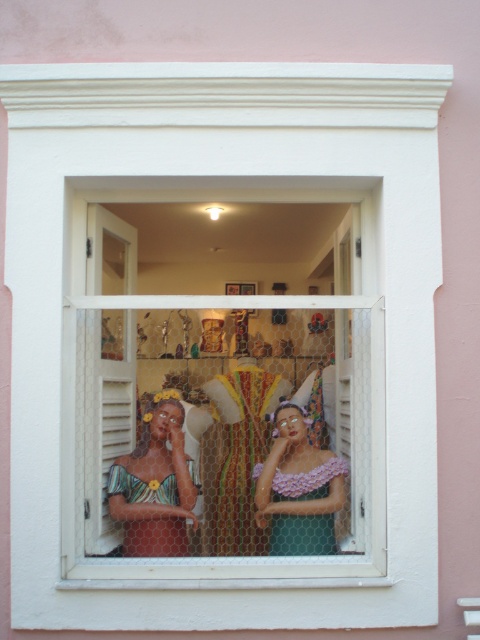
Describe the element at coordinates (224, 378) in the screenshot. I see `transparent plastic dolls at center` at that location.

Between transparent plastic dolls at center and matte green dress at center, which one is positioned higher?

transparent plastic dolls at center is higher up.

What do you see at coordinates (224, 378) in the screenshot? Image resolution: width=480 pixels, height=640 pixels. I see `transparent plastic dolls at center` at bounding box center [224, 378].

You are a GUI agent. You are given a task and a screenshot of the screen. Output one action in this format:
    pyautogui.click(x=<x>, y=<y>)
    Task: Click on the transparent plastic dolls at center
    
    Given the screenshot: What is the action you would take?
    pyautogui.click(x=224, y=378)

Who is lower down, multicolored fabric dress at center or matte green dress at center?

matte green dress at center is lower down.

Is multicolored fabric dress at center behind matte green dress at center?

No, multicolored fabric dress at center is closer to the viewer.

Which is behind, point (133, 477) or point (279, 410)?

Point (279, 410)

The image size is (480, 640). I want to click on multicolored fabric dress at center, so click(x=155, y=484).

The width and height of the screenshot is (480, 640). What do you see at coordinates (224, 378) in the screenshot?
I see `transparent plastic dolls at center` at bounding box center [224, 378].

Can you confirm if transparent plastic dolls at center is bigger than multicolored fabric dress at center?

Correct, transparent plastic dolls at center is larger in size than multicolored fabric dress at center.

Who is more forward, (213, 188) or (131, 484)?

Positioned in front is point (131, 484).

This screenshot has width=480, height=640. I want to click on transparent plastic dolls at center, so pos(224,378).